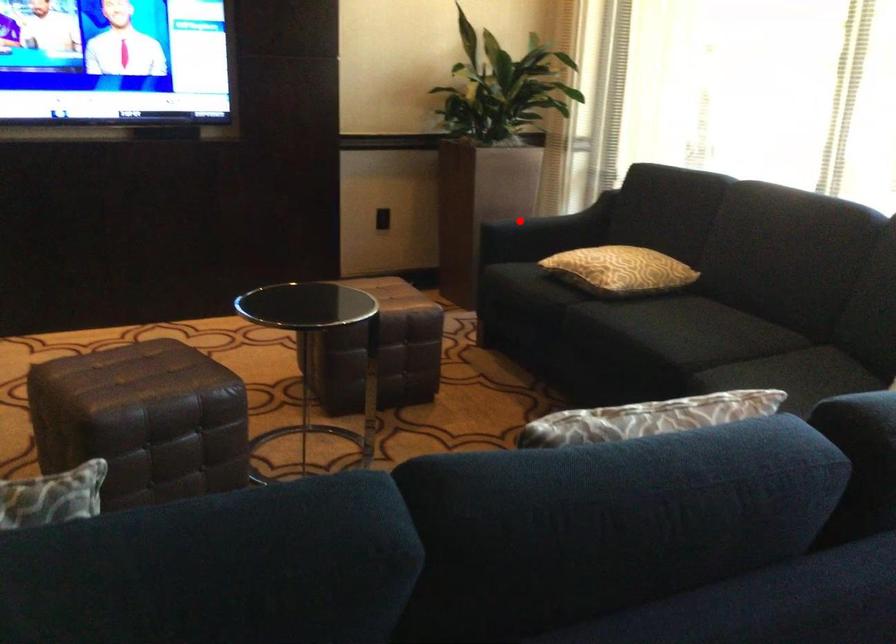
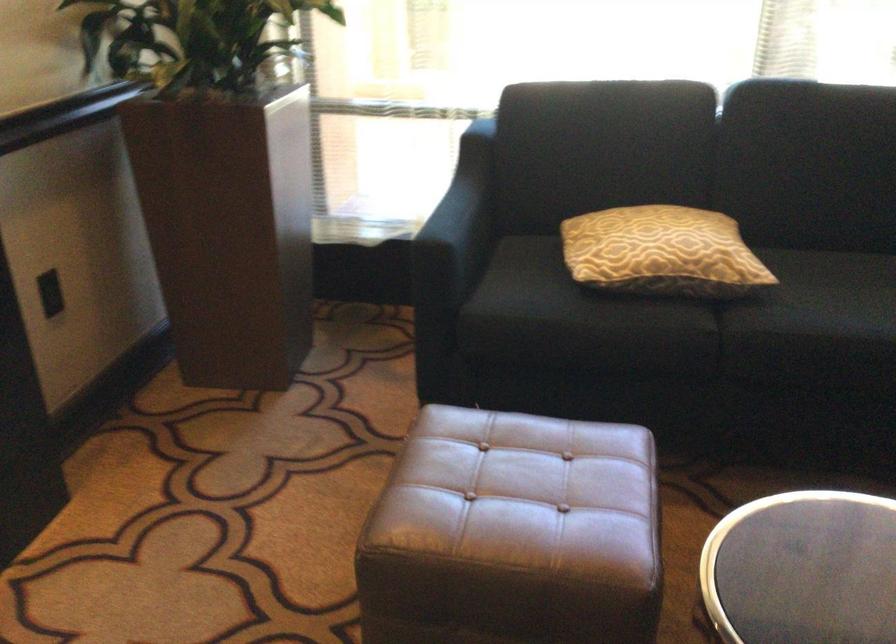
Locate, in the second image, the point that corresponds to the highlighted location in the first image.

(458, 225)